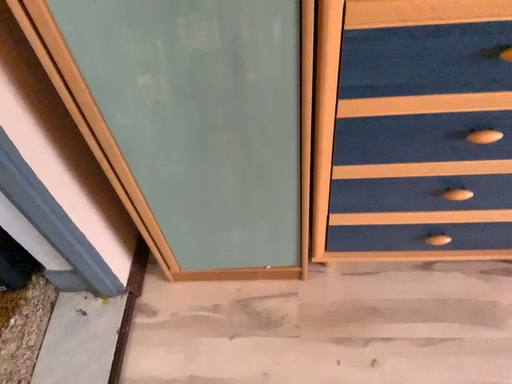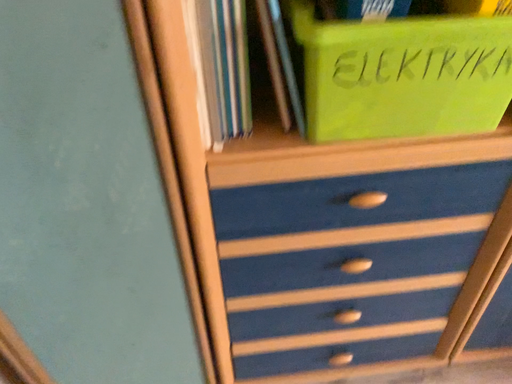
Question: How did the camera likely rotate when shooting the video?

Choices:
 (A) rotated left
 (B) rotated right

Answer: (B)